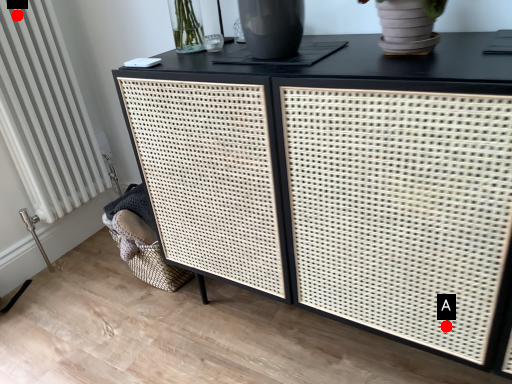
Question: Two points are circled on the image, labeled by A and B beside each circle. Which of the following is the farthest from the observer?

Choices:
 (A) A is further
 (B) B is further

Answer: (B)